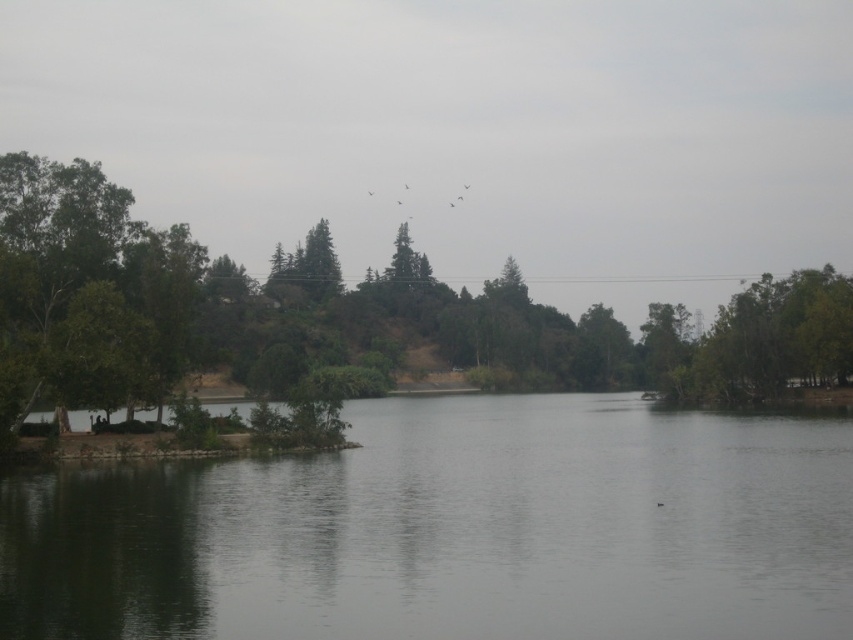
You are a kayaker planning to cross the lake from the green leafy tree at left to the smooth gray water at center. The kayak can only handle distances up to 150 feet. Do you think you can make the crossing?

The distance between the green leafy tree at left and the smooth gray water at center is 143.88 feet, which is within the kayak maximum distance of 150 feet. Yes, you can make the crossing.

You are a photographer wanting to capture the smooth gray water at center and the green leafy tree at left in a single shot. Based on their heights, which object will appear taller in the photo?

The green leafy tree at left will appear taller in the photo since it has a greater height than the smooth gray water at center.

You are standing at the lakeside and want to take a photo of the smooth gray water at center and the green leafy tree at left. Which object should you focus on first to ensure both are in the frame?

You should focus on the smooth gray water at center first because it is in front of the green leafy tree at left, so positioning the camera to capture the water will naturally include the tree in the background.